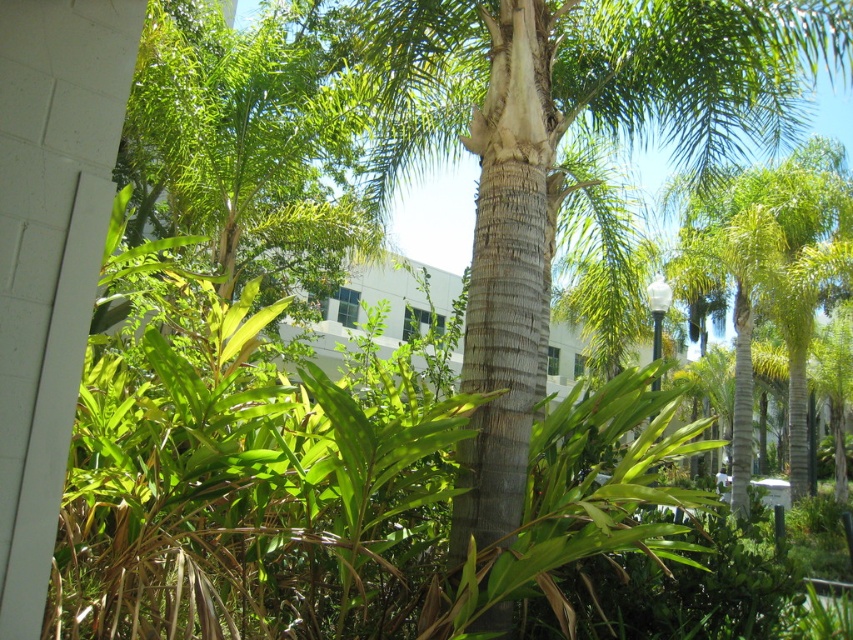
Based on the photo, between smooth brown trunk at center and green textured palm tree at center, which one appears on the left side from the viewer's perspective?

Positioned to the left is smooth brown trunk at center.

Between smooth brown trunk at center and green textured palm tree at center, which one is positioned lower?

green textured palm tree at center is lower down.

Is point (329, 28) farther from camera compared to point (778, 266)?

No, (329, 28) is closer to viewer.

Locate an element on the screen. The image size is (853, 640). smooth brown trunk at center is located at coordinates pyautogui.click(x=556, y=148).